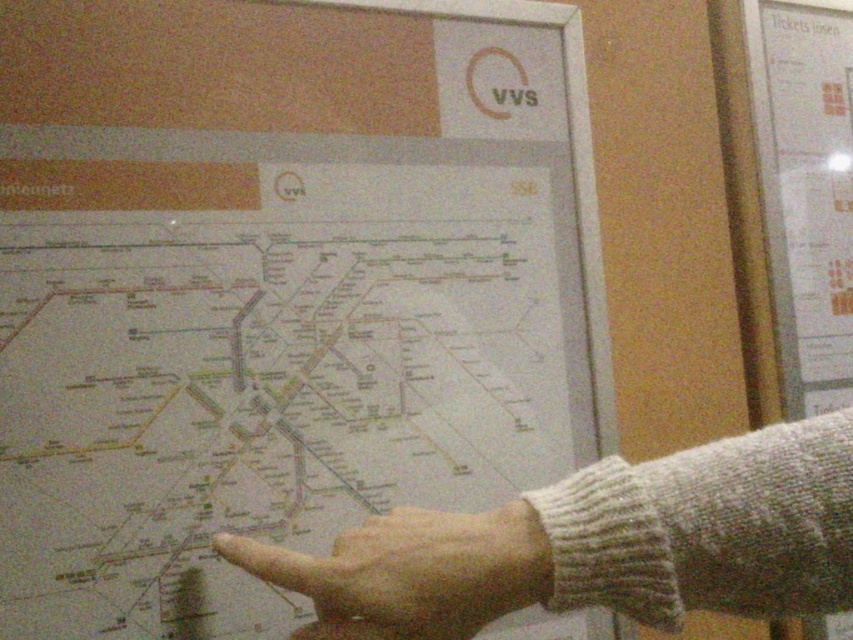
Question: Is white paper map at center further to camera compared to gray knitted sweater at center?

Choices:
 (A) yes
 (B) no

Answer: (A)

Question: Does white paper map at center appear on the left side of gray knitted sweater at center?

Choices:
 (A) yes
 (B) no

Answer: (A)

Question: Which point is closer to the camera?

Choices:
 (A) (410, 579)
 (B) (74, 188)
 (C) (714, 576)

Answer: (C)

Question: Does gray knitted sweater at center appear on the right side of skinny white finger at center?

Choices:
 (A) no
 (B) yes

Answer: (B)

Question: Which object appears closest to the camera in this image?

Choices:
 (A) white paper map at center
 (B) skinny white finger at center

Answer: (B)

Question: Based on their relative distances, which object is farther from the gray knitted sweater at center?

Choices:
 (A) skinny white finger at center
 (B) white paper map at center

Answer: (B)